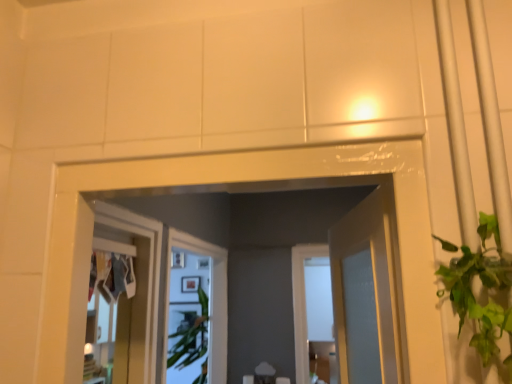
At what (x,y) coordinates should I click in order to perform the action: click on clear glass screen door at center. Please return your answer as a coordinate pair (x, y). The width and height of the screenshot is (512, 384). Looking at the image, I should click on (212, 302).

What do you see at coordinates (212, 302) in the screenshot?
I see `clear glass screen door at center` at bounding box center [212, 302].

Locate an element on the screen. The image size is (512, 384). clear glass screen door at center is located at coordinates (212, 302).